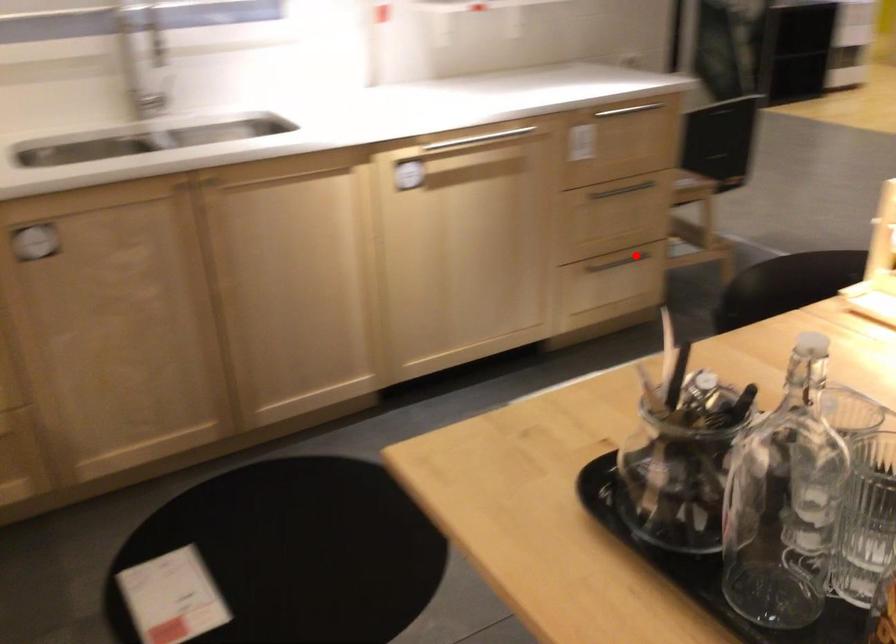
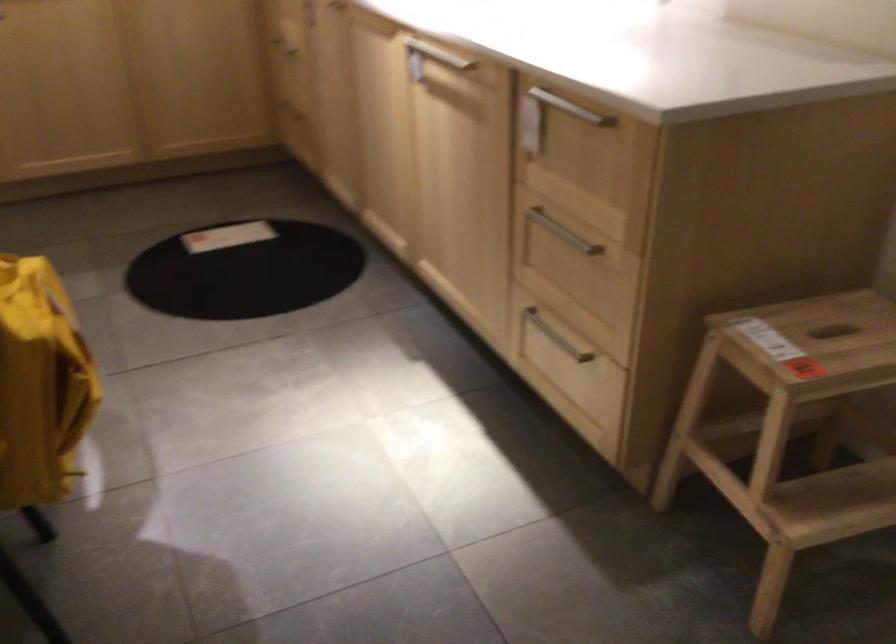
Where in the second image is the point corresponding to the highlighted location from the first image?

(556, 337)